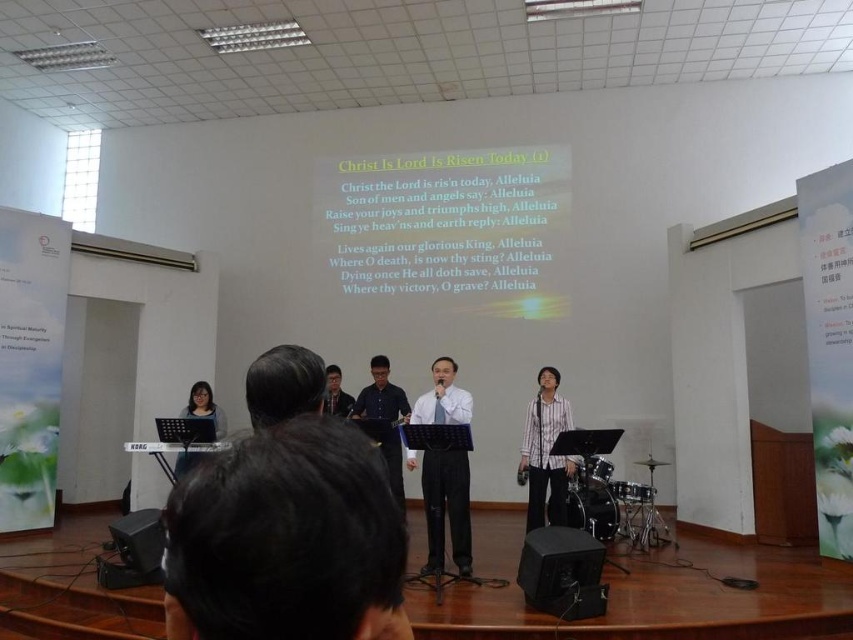
Who is shorter, yellow paper at center or matte black shirt at center?

matte black shirt at center is shorter.

Who is positioned more to the right, yellow paper at center or matte black shirt at center?

Positioned to the right is yellow paper at center.

Is point (460, 173) positioned behind point (329, 387)?

That is True.

This screenshot has width=853, height=640. Identify the location of yellow paper at center. (451, 227).

Which of these two, yellow paper at center or white striped shirt at right, stands shorter?

Standing shorter between the two is white striped shirt at right.

Is yellow paper at center to the right of white striped shirt at right from the viewer's perspective?

No, yellow paper at center is not to the right of white striped shirt at right.

Between point (527, 296) and point (538, 433), which one is positioned in front?

Point (538, 433) is more forward.

The image size is (853, 640). I want to click on yellow paper at center, so click(x=451, y=227).

Consider the image. Does black hair at center appear over black matte speaker at lower right?

Correct, black hair at center is located above black matte speaker at lower right.

Between point (210, 493) and point (541, 545), which one is positioned in front?

Point (210, 493)

Locate an element on the screen. The image size is (853, 640). black hair at center is located at coordinates (286, 540).